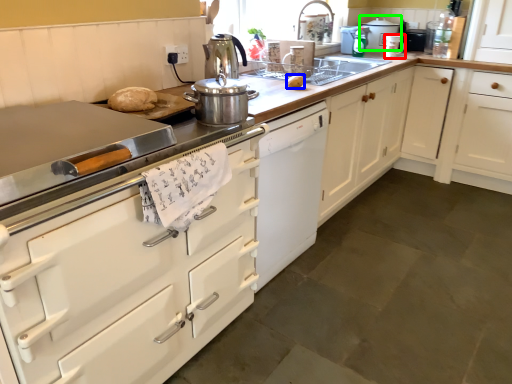
Question: Estimate the real-world distances between objects in this image. Which object is closer to kitchen appliance (highlighted by a red box), food (highlighted by a blue box) or kitchen appliance (highlighted by a green box)?

Choices:
 (A) food
 (B) kitchen appliance

Answer: (B)